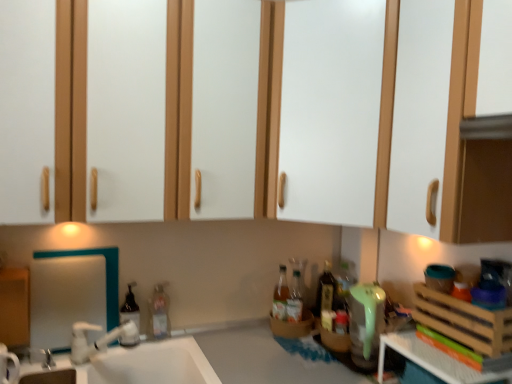
In order to face white glossy mirror at left, should I rotate leftwards or rightwards?

It's best to rotate left around 22.793 degrees.

What do you see at coordinates (326, 290) in the screenshot? I see `translucent glass bottle at center, the first bottle positioned from the right` at bounding box center [326, 290].

This screenshot has width=512, height=384. Identify the location of translucent glass bottle at center, the first bottle positioned from the right. (326, 290).

At what (x,y) coordinates should I click in order to perform the action: click on white matte cabinet at upper center. Please return your answer as a coordinate pair (x, y). The image size is (512, 384). Looking at the image, I should click on (110, 114).

What is the approximate width of translucent glass bottles at right, positioned as the second bottle in right-to-left order?

translucent glass bottles at right, positioned as the second bottle in right-to-left order, is 2.26 inches wide.

This screenshot has height=384, width=512. What do you see at coordinates (293, 326) in the screenshot?
I see `brown woven basket at lower center, the first basket positioned from the left` at bounding box center [293, 326].

The image size is (512, 384). Identify the location of translucent plastic bottle at sink, placed as the 2th bottle when sorted from left to right. (159, 312).

Is the depth of white plastic tap at lower left less than that of white matte cabinet at upper center?

No.

From the image's perspective, does white plastic tap at lower left appear higher than white matte cabinet at upper center?

No.

Can you confirm if white plastic tap at lower left is thinner than white matte cabinet at upper center?

Indeed, white plastic tap at lower left has a lesser width compared to white matte cabinet at upper center.

Considering the relative sizes of white plastic tap at lower left and white matte cabinet at upper center in the image provided, is white plastic tap at lower left taller than white matte cabinet at upper center?

Incorrect, the height of white plastic tap at lower left is not larger of that of white matte cabinet at upper center.

Is white plastic tap at lower left a part of wooden crate at right, the first basket from the right?

No, white plastic tap at lower left is not inside wooden crate at right, the first basket from the right.

Could you tell me if wooden crate at right, the 3th basket positioned from the left, is turned towards white plastic tap at lower left?

Yes.

Who is smaller, wooden crate at right, the 3th basket positioned from the left, or white plastic tap at lower left?

With smaller size is white plastic tap at lower left.

From their relative heights in the image, would you say white plastic crate at lower right is taller or shorter than translucent plastic soap dispenser at sink, the 4th bottle in the right-to-left sequence?

Clearly, white plastic crate at lower right is shorter compared to translucent plastic soap dispenser at sink, the 4th bottle in the right-to-left sequence.

Is white plastic crate at lower right next to translucent plastic soap dispenser at sink, placed as the 1th bottle when sorted from left to right, and touching it?

white plastic crate at lower right and translucent plastic soap dispenser at sink, placed as the 1th bottle when sorted from left to right, are clearly separated.

Can you confirm if white plastic crate at lower right is positioned to the left of translucent plastic soap dispenser at sink, the 4th bottle in the right-to-left sequence?

No.

Which object is closer to the camera, white plastic crate at lower right or translucent plastic soap dispenser at sink, placed as the 1th bottle when sorted from left to right?

white plastic crate at lower right is in front.

Between translucent plastic soap dispenser at sink, the 4th bottle in the right-to-left sequence, and wooden basket at lower right, marked as the second basket in a left-to-right arrangement, which one has less height?

With less height is wooden basket at lower right, marked as the second basket in a left-to-right arrangement.

Considering the points (121, 338) and (328, 336), which point is in front, point (121, 338) or point (328, 336)?

Positioned in front is point (121, 338).

Between translucent plastic soap dispenser at sink, placed as the 1th bottle when sorted from left to right, and wooden basket at lower right, the first basket positioned from the bottom, which one appears on the left side from the viewer's perspective?

translucent plastic soap dispenser at sink, placed as the 1th bottle when sorted from left to right.

Which basket is the 2nd one when counting from the right side of the translucent plastic soap dispenser at sink, placed as the 1th bottle when sorted from left to right? Please provide its 2D coordinates.

[(333, 339)]

Is translucent plastic soap dispenser at sink, the 4th bottle in the right-to-left sequence, in front of or behind white plastic tap at lower left in the image?

translucent plastic soap dispenser at sink, the 4th bottle in the right-to-left sequence, is positioned farther from the viewer than white plastic tap at lower left.

Based on the photo, which is closer to the camera, (126, 313) or (75, 354)?

Point (126, 313) appears to be farther away from the viewer than point (75, 354).

Is translucent plastic soap dispenser at sink, the 4th bottle in the right-to-left sequence, turned away from white plastic tap at lower left?

No, translucent plastic soap dispenser at sink, the 4th bottle in the right-to-left sequence, is not facing the opposite direction of white plastic tap at lower left.

Can you see translucent plastic soap dispenser at sink, the 4th bottle in the right-to-left sequence, touching white plastic tap at lower left?

Yes, translucent plastic soap dispenser at sink, the 4th bottle in the right-to-left sequence, is next to white plastic tap at lower left.

Considering the relative sizes of white plastic tap at lower left and white plastic crate at lower right in the image provided, is white plastic tap at lower left bigger than white plastic crate at lower right?

No, white plastic tap at lower left is not bigger than white plastic crate at lower right.

Considering the positions of objects white plastic tap at lower left and white plastic crate at lower right in the image provided, who is behind, white plastic tap at lower left or white plastic crate at lower right?

white plastic tap at lower left.

Is white plastic tap at lower left positioned with its back to white plastic crate at lower right?

white plastic tap at lower left does not have its back to white plastic crate at lower right.

Can you confirm if white plastic tap at lower left is taller than white plastic crate at lower right?

Yes, white plastic tap at lower left is taller than white plastic crate at lower right.

Between white glossy mirror at left and wooden basket at lower right, the 3th basket viewed from the top, which one appears on the left side from the viewer's perspective?

white glossy mirror at left is more to the left.

In the scene shown: What's the angular difference between white glossy mirror at left and wooden basket at lower right, the second basket viewed from the back,'s facing directions?

They differ by 63 degrees in their facing directions.

Is point (116, 257) positioned before point (336, 342)?

Yes, it is.

Between white glossy mirror at left and wooden basket at lower right, which is the 2th basket from front to back, which one has larger width?

Wider between the two is wooden basket at lower right, which is the 2th basket from front to back.

Where is `tap to the left of white matte cabinet at upper center`? This screenshot has width=512, height=384. tap to the left of white matte cabinet at upper center is located at coordinates (98, 339).

The width and height of the screenshot is (512, 384). What are the coordinates of `basket in front of the white plastic tap at lower left` in the screenshot? It's located at (464, 321).

Based on their spatial positions, is wooden basket at lower right, the 3th basket viewed from the top, or white plastic tap at lower left closer to white plastic crate at lower right?

wooden basket at lower right, the 3th basket viewed from the top.

Based on their spatial positions, is brown woven basket at lower center, positioned as the 1th basket in back-to-front order, or translucent glass bottle at center, which is the fourth bottle in left-to-right order, further from wooden crate at right, the 3th basket positioned from the left?

brown woven basket at lower center, positioned as the 1th basket in back-to-front order, lies further to wooden crate at right, the 3th basket positioned from the left, than the other object.

Based on their spatial positions, is translucent plastic bottle at sink, placed as the 2th bottle when sorted from left to right, or white glossy sink at lower left closer to translucent glass bottles at right, positioned as the third bottle in left-to-right order?

Among the two, translucent plastic bottle at sink, placed as the 2th bottle when sorted from left to right, is located nearer to translucent glass bottles at right, positioned as the third bottle in left-to-right order.

Which object lies further to the anchor point translucent glass bottle at center, which is the fourth bottle in left-to-right order, white plastic tap at lower left or white glossy sink at lower left?

white plastic tap at lower left is positioned further to the anchor translucent glass bottle at center, which is the fourth bottle in left-to-right order.

From the image, which object appears to be nearer to white glossy mirror at left, white plastic crate at lower right or translucent plastic bottle at sink, which ranks as the 3th bottle in right-to-left order?

translucent plastic bottle at sink, which ranks as the 3th bottle in right-to-left order, is positioned closer to the anchor white glossy mirror at left.

Based on their spatial positions, is translucent plastic bottle at sink, placed as the 2th bottle when sorted from left to right, or wooden basket at lower right, which is the 2th basket from front to back, further from white matte cabinet at upper center?

wooden basket at lower right, which is the 2th basket from front to back, is positioned further to the anchor white matte cabinet at upper center.

Which object lies further to the anchor point translucent plastic bottle at sink, placed as the 2th bottle when sorted from left to right, wooden crate at right, which is the 3th basket in back-to-front order, or white plastic tap at lower left?

Among the two, wooden crate at right, which is the 3th basket in back-to-front order, is located further to translucent plastic bottle at sink, placed as the 2th bottle when sorted from left to right.

When comparing their distances from white glossy mirror at left, does white plastic tap at lower left or white glossy sink at lower left seem closer?

white plastic tap at lower left.

You are a GUI agent. You are given a task and a screenshot of the screen. Output one action in this format:
    pyautogui.click(x=<x>, y=<y>)
    Task: Click on the basket situated between translucent plastic bottle at sink, which ranks as the 3th bottle in right-to-left order, and translucent glass bottles at right, positioned as the third bottle in left-to-right order, from left to right
    
    Given the screenshot: What is the action you would take?
    pyautogui.click(x=293, y=326)

The image size is (512, 384). Identify the location of tap between white matte cabinet at upper center and wooden basket at lower right, which is the 2th basket from front to back, vertically. coord(98,339).

The image size is (512, 384). What are the coordinates of `tap between white matte cabinet at upper center and brown woven basket at lower center, which is the third basket in front-to-back order, in the vertical direction` in the screenshot? It's located at [x=98, y=339].

Where is `tap between white matte cabinet at upper center and white glossy sink at lower left vertically`? The image size is (512, 384). tap between white matte cabinet at upper center and white glossy sink at lower left vertically is located at coordinates (98, 339).